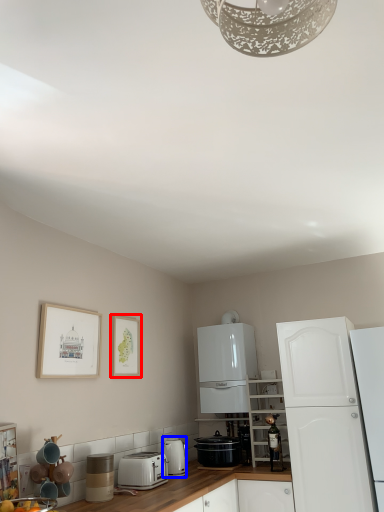
Question: Among these objects, which one is nearest to the camera, picture frame (highlighted by a red box) or kitchen appliance (highlighted by a blue box)?

Choices:
 (A) picture frame
 (B) kitchen appliance

Answer: (A)